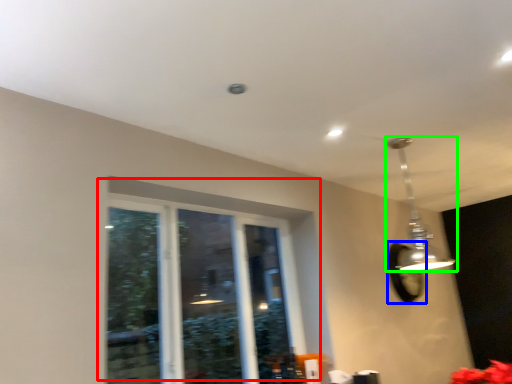
Question: Which object is positioned farthest from window (highlighted by a red box)? Select from mirror (highlighted by a blue box) and lamp (highlighted by a green box).

Choices:
 (A) mirror
 (B) lamp

Answer: (A)